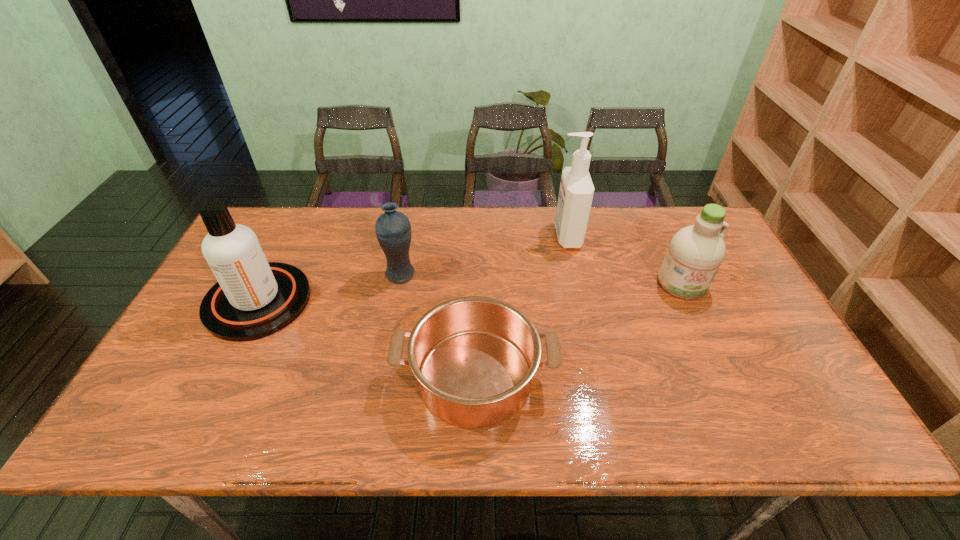
Where is `vacant area between the saucepan and the second cleansing agent from left to right`? vacant area between the saucepan and the second cleansing agent from left to right is located at coordinates (521, 306).

Locate which object ranks fourth in proximity to the rightmost object. Please provide its 2D coordinates. Your answer should be formatted as a tuple, i.e. [(x, y)], where the tuple contains the x and y coordinates of a point satisfying the conditions above.

[(253, 298)]

I want to click on object that is the second nearest to the farthest object, so click(474, 358).

Where is `cleansing agent that is the second closest one to the leftmost object`? Image resolution: width=960 pixels, height=540 pixels. cleansing agent that is the second closest one to the leftmost object is located at coordinates (695, 253).

Identify which cleansing agent is the nearest to the rightmost object. Please provide its 2D coordinates. Your answer should be formatted as a tuple, i.e. [(x, y)], where the tuple contains the x and y coordinates of a point satisfying the conditions above.

[(576, 191)]

Find the location of a particular element. The image size is (960, 540). vacant space that satisfies the following two spatial constraints: 1. on the front side of the saucepan; 2. on the left side of the leftmost cleansing agent is located at coordinates (221, 376).